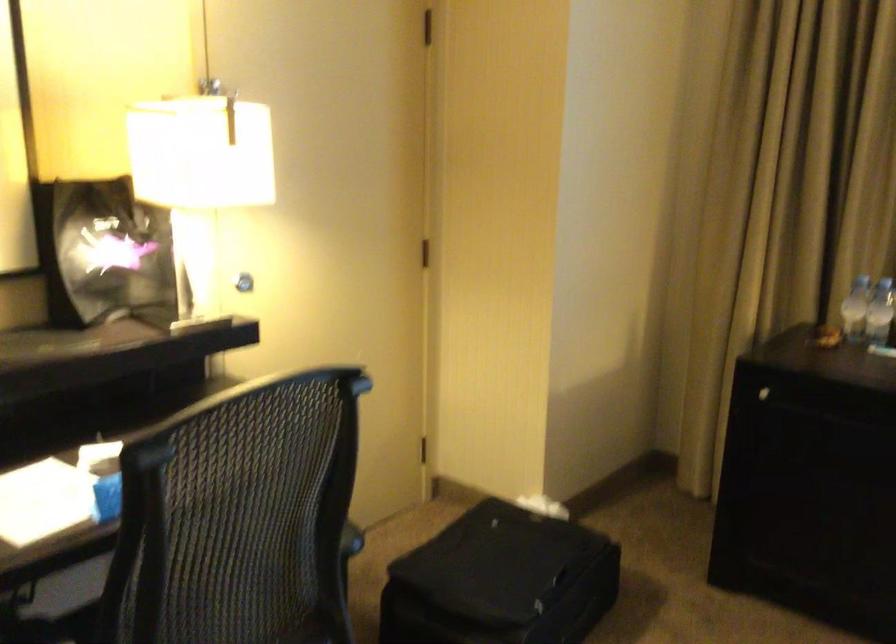
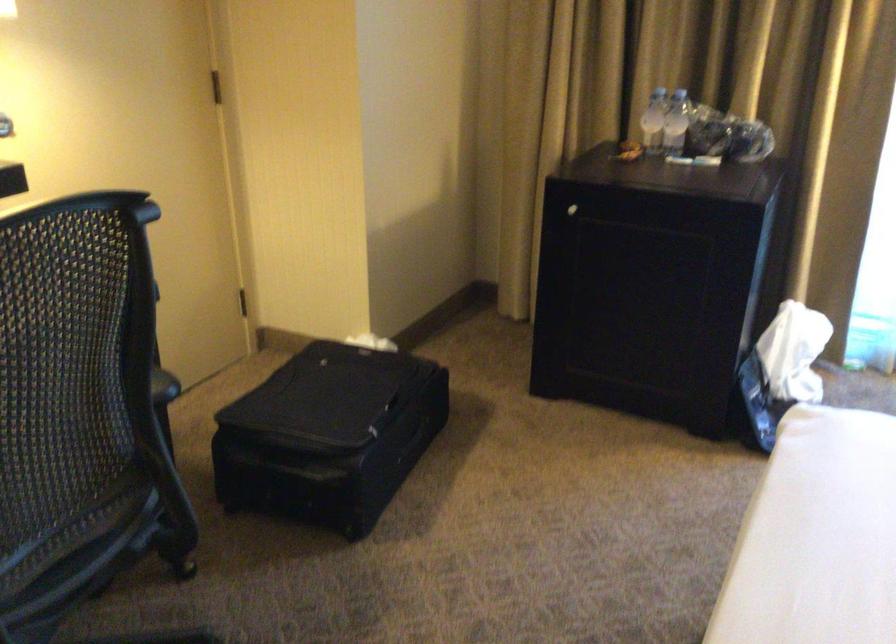
Find the pixel in the second image that matches (x=762, y=391) in the first image.

(572, 210)